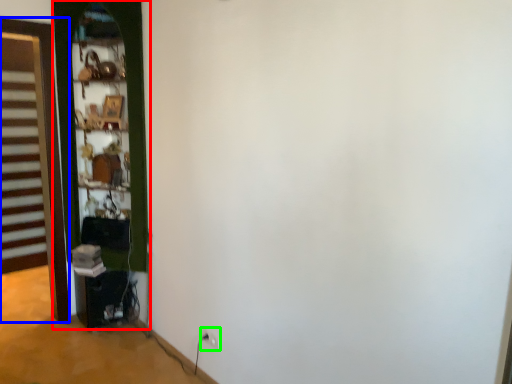
Question: Estimate the real-world distances between objects in this image. Which object is closer to door (highlighted by a red box), door (highlighted by a blue box) or electric outlet (highlighted by a green box)?

Choices:
 (A) door
 (B) electric outlet

Answer: (B)